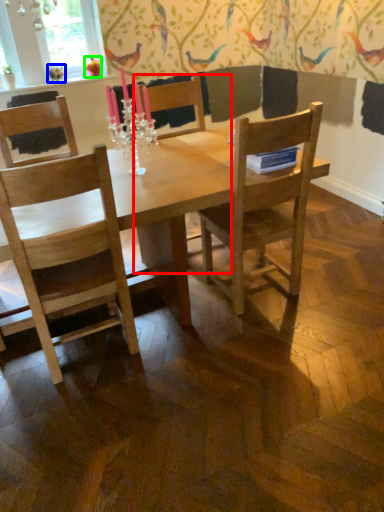
Question: Considering the real-world distances, which object is closest to armchair (highlighted by a red box)? bird (highlighted by a blue box) or bird (highlighted by a green box).

Choices:
 (A) bird
 (B) bird

Answer: (B)